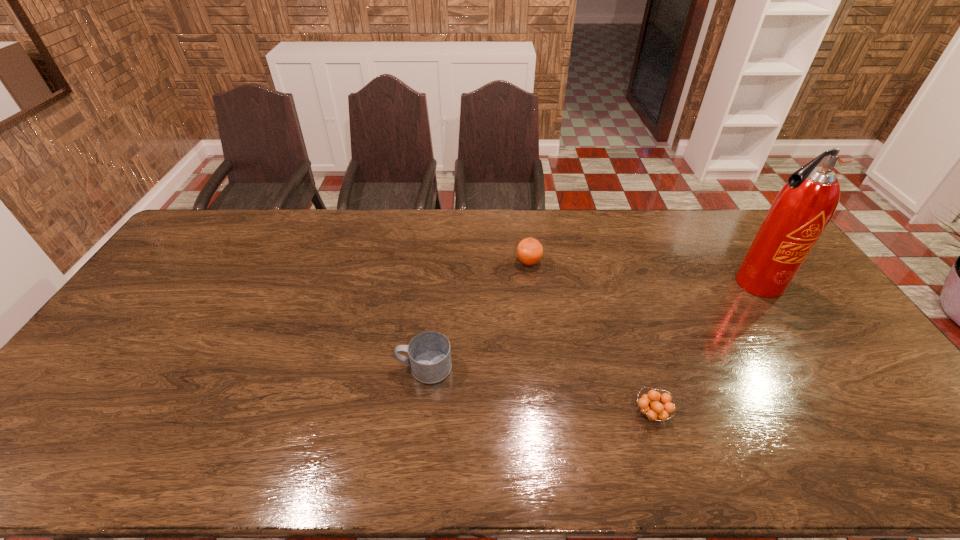
You are a GUI agent. You are given a task and a screenshot of the screen. Output one action in this format:
    pyautogui.click(x=<x>, y=<y>)
    Task: Click on the tallest object
    The height and width of the screenshot is (540, 960).
    Given the screenshot: What is the action you would take?
    pyautogui.click(x=801, y=211)

Where is `the rightmost object`? The width and height of the screenshot is (960, 540). the rightmost object is located at coordinates (801, 211).

Identify the location of the third object from right to left. (529, 251).

Locate an element on the screen. the taller orange fruit is located at coordinates (529, 251).

What are the coordinates of `the leftmost object` in the screenshot? It's located at (429, 353).

Locate an element on the screen. Image resolution: width=960 pixels, height=540 pixels. mug is located at coordinates (429, 353).

Find the location of a particular element. the nearer orange fruit is located at coordinates (652, 409).

Find the location of a particular element. The height and width of the screenshot is (540, 960). the nearest object is located at coordinates (652, 409).

Find the location of `vacant space located on the left of the rightmost object`. vacant space located on the left of the rightmost object is located at coordinates (630, 283).

You are a GUI agent. You are given a task and a screenshot of the screen. Output one action in this format:
    pyautogui.click(x=<x>, y=<y>)
    Task: Click on the free location located 0.240m on the front of the taller orange fruit
    The image size is (960, 540).
    Given the screenshot: What is the action you would take?
    pyautogui.click(x=537, y=326)